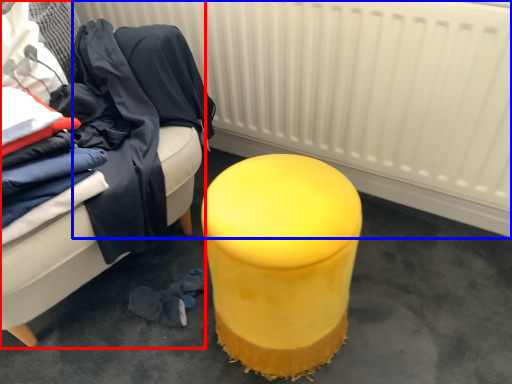
Question: Which object is closer to the camera taking this photo, furniture (highlighted by a red box) or radiator (highlighted by a blue box)?

Choices:
 (A) furniture
 (B) radiator

Answer: (A)